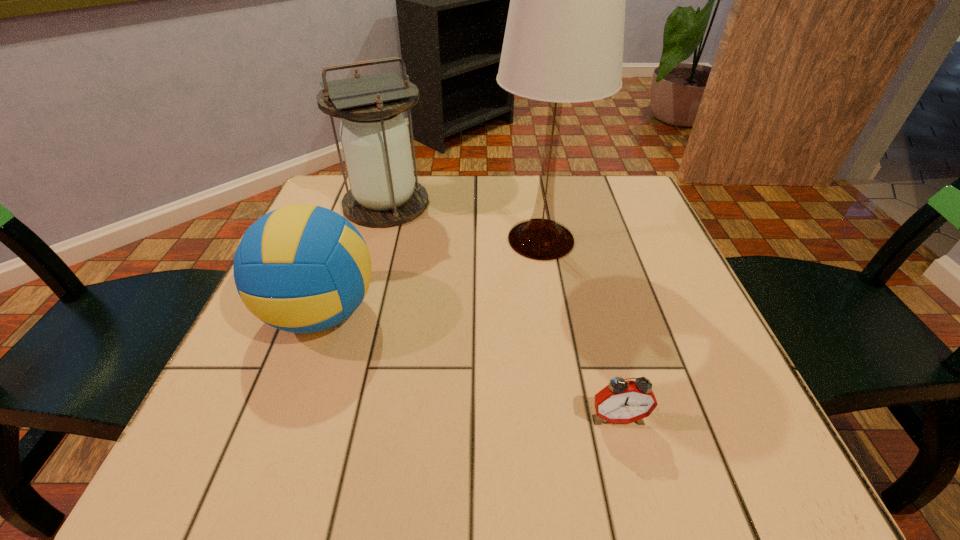
Identify which object is the closest to the alarm clock. Please provide its 2D coordinates. Your answer should be formatted as a tuple, i.e. [(x, y)], where the tuple contains the x and y coordinates of a point satisfying the conditions above.

[(563, 43)]

Find the location of `object that can be found as the second closest to the nearest object`. object that can be found as the second closest to the nearest object is located at coordinates (302, 268).